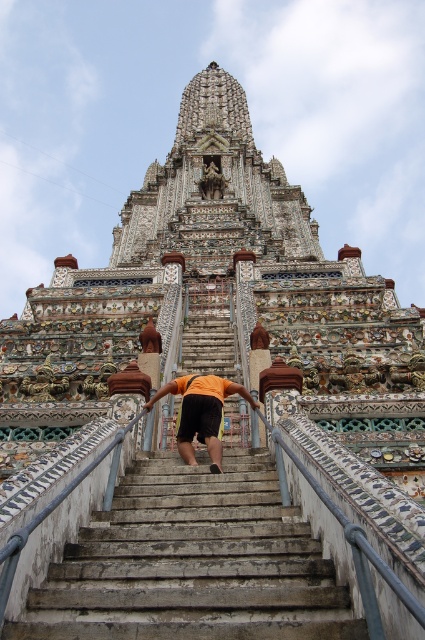
Question: Is white stone stairs at center smaller than orange fabric at center?

Choices:
 (A) yes
 (B) no

Answer: (B)

Question: Which point is closer to the camera taking this photo?

Choices:
 (A) (209, 452)
 (B) (142, 483)

Answer: (B)

Question: Does white stone stairs at center have a smaller size compared to orange fabric at center?

Choices:
 (A) yes
 (B) no

Answer: (B)

Question: Can you confirm if white stone stairs at center is positioned to the left of orange fabric at center?

Choices:
 (A) no
 (B) yes

Answer: (A)

Question: Which object appears closest to the camera in this image?

Choices:
 (A) orange fabric at center
 (B) white stone stairs at center

Answer: (B)

Question: Which of the following is the farthest from the observer?

Choices:
 (A) white stone stairs at center
 (B) orange fabric at center

Answer: (B)